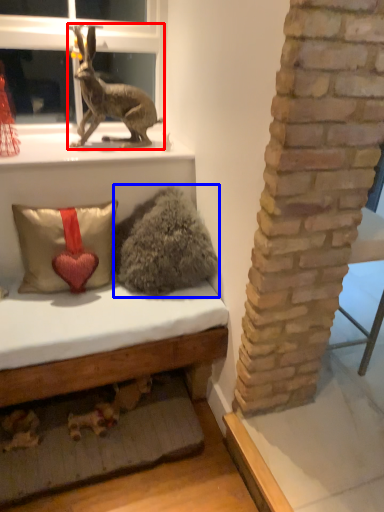
Question: Among these objects, which one is nearest to the camera, rabbit (highlighted by a red box) or animal (highlighted by a blue box)?

Choices:
 (A) rabbit
 (B) animal

Answer: (B)